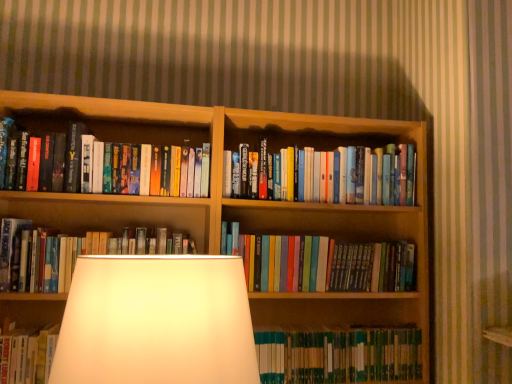
Question: Is wooden bookcase at center located outside hardcover books at center, the 2th book positioned from the bottom?

Choices:
 (A) no
 (B) yes

Answer: (B)

Question: Does wooden bookcase at center touch hardcover books at center, the 4th book viewed from the top?

Choices:
 (A) yes
 (B) no

Answer: (B)

Question: Considering the relative positions of wooden bookcase at center and hardcover books at center, the 4th book viewed from the top, in the image provided, is wooden bookcase at center behind hardcover books at center, the 4th book viewed from the top,?

Choices:
 (A) yes
 (B) no

Answer: (B)

Question: Does wooden bookcase at center have a lesser width compared to hardcover books at center, the 4th book viewed from the top?

Choices:
 (A) no
 (B) yes

Answer: (A)

Question: Can you confirm if wooden bookcase at center is wider than hardcover books at center, the 4th book viewed from the top?

Choices:
 (A) yes
 (B) no

Answer: (A)

Question: Relative to hardcover books at center, the 4th book viewed from the top, is hardcover books at center, which ranks as the third book in top-to-bottom order, in front or behind?

Choices:
 (A) behind
 (B) front

Answer: (B)

Question: Is point (23, 289) positioned closer to the camera than point (391, 264)?

Choices:
 (A) closer
 (B) farther

Answer: (A)

Question: Is hardcover books at center, which ranks as the third book in top-to-bottom order, bigger or smaller than hardcover books at center, the 4th book viewed from the top?

Choices:
 (A) big
 (B) small

Answer: (B)

Question: From the image's perspective, is hardcover books at center, positioned as the third book in bottom-to-top order, above or below hardcover books at center, the 4th book viewed from the top?

Choices:
 (A) below
 (B) above

Answer: (B)

Question: Is point [x=152, y=160] positioned closer to the camera than point [x=349, y=278]?

Choices:
 (A) farther
 (B) closer

Answer: (B)

Question: Considering their positions, is hardcover books at left, marked as the fifth book in a bottom-to-top arrangement, located in front of or behind hardcover books at center, the 2th book positioned from the bottom?

Choices:
 (A) behind
 (B) front

Answer: (B)

Question: In the image, is hardcover books at left, marked as the fifth book in a bottom-to-top arrangement, on the left side or the right side of hardcover books at center, the 2th book positioned from the bottom?

Choices:
 (A) left
 (B) right

Answer: (A)

Question: From a real-world perspective, is hardcover books at left, the first book when ordered from top to bottom, positioned above or below hardcover books at center, the 2th book positioned from the bottom?

Choices:
 (A) below
 (B) above

Answer: (B)

Question: Is green hardcover book at center, acting as the fifth book starting from the top, wider or thinner than hardcover books at left, the first book when ordered from top to bottom?

Choices:
 (A) wide
 (B) thin

Answer: (B)

Question: In the image, is green hardcover book at center, acting as the fifth book starting from the top, positioned in front of or behind hardcover books at left, the first book when ordered from top to bottom?

Choices:
 (A) front
 (B) behind

Answer: (B)